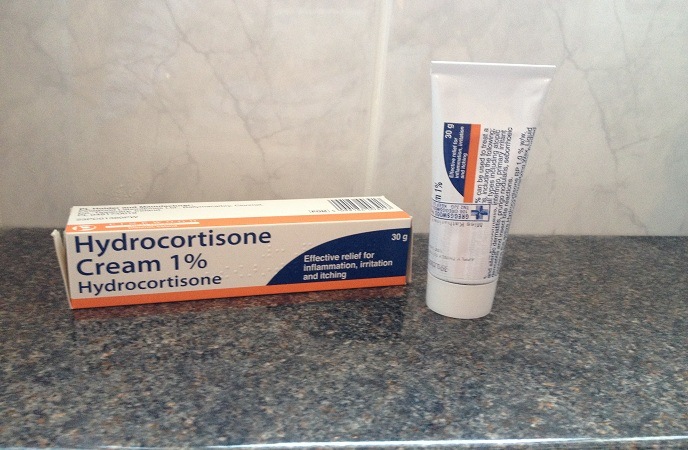
Locate an element on the screen. The height and width of the screenshot is (450, 688). box is located at coordinates (283, 208).